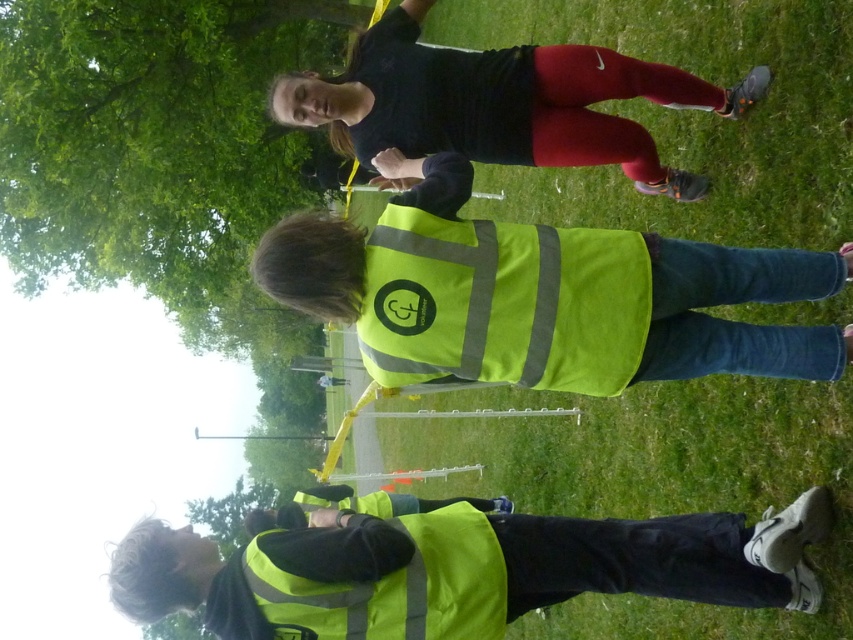
You are standing in a park and see the neon yellow reflective vest at center. If you want to hand a document to someone wearing the vest without moving closer than 2 meters, can you do it?

The neon yellow reflective vest at center and viewer are 2.75 meters apart from each other, so yes, you can hand the document without moving closer than 2 meters since the distance is already more than 2 meters.

You are a photographer trying to capture a clear shot of the neon yellow reflective vest at center without any obstructions. Based on the scene, is the green leafy tree at upper left blocking your view of the vest?

The green leafy tree at upper left is positioned over the neon yellow reflective vest at center, so it would block the view of the vest.

You are a safety inspector checking the visibility of vests in a park scene. You see the neon yellow reflective vest at center and the high visibility vest at lower center. Which vest is closer to you?

The neon yellow reflective vest at center is closer to you because it is positioned in front of the high visibility vest at lower center.